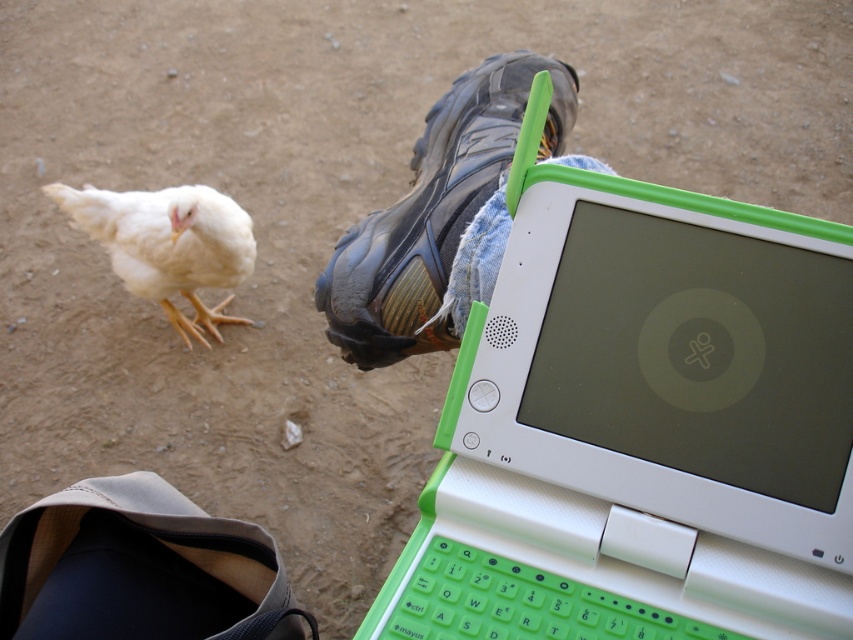
Question: Can you confirm if green plastic laptop at center is positioned to the right of white feathered chicken at lower left?

Choices:
 (A) no
 (B) yes

Answer: (B)

Question: From the image, what is the correct spatial relationship of green plastic laptop at center in relation to white feathered chicken at lower left?

Choices:
 (A) above
 (B) below

Answer: (B)

Question: Where is green plastic laptop at center located in relation to white feathered chicken at lower left in the image?

Choices:
 (A) left
 (B) right

Answer: (B)